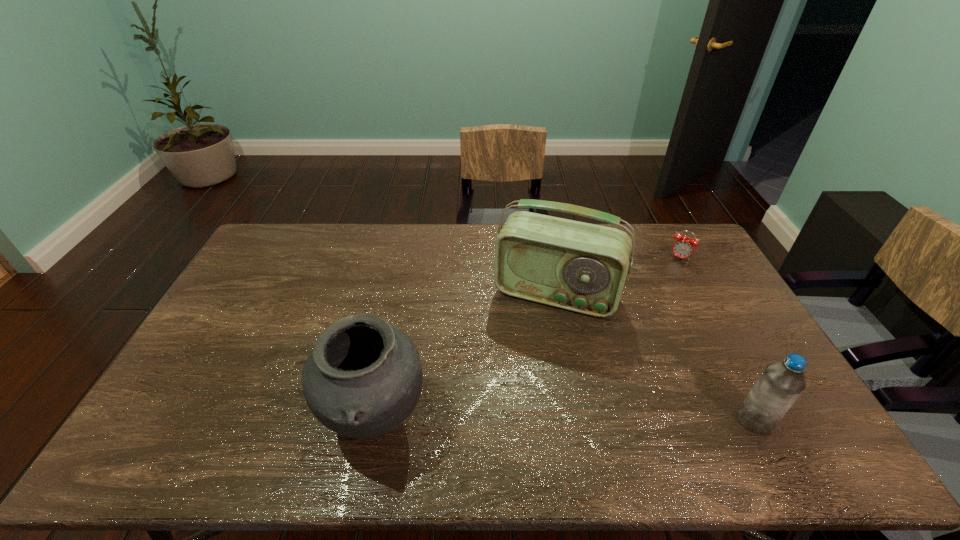
You are a GUI agent. You are given a task and a screenshot of the screen. Output one action in this format:
    pyautogui.click(x=<x>, y=<y>)
    Task: Click on the vacant area situated on the front panel of the second object from left to right
    The image size is (960, 540).
    Given the screenshot: What is the action you would take?
    pyautogui.click(x=506, y=412)

Locate an element on the screen. The image size is (960, 540). vacant space positioned on the front panel of the second object from left to right is located at coordinates (535, 333).

Locate an element on the screen. Image resolution: width=960 pixels, height=540 pixels. vacant region located 0.060m on the face of the alarm clock is located at coordinates pos(671,272).

Find the location of `free space located 0.150m on the face of the alarm clock`. free space located 0.150m on the face of the alarm clock is located at coordinates (662, 286).

What are the coordinates of `free space located on the face of the alarm clock` in the screenshot? It's located at (649, 310).

Locate an element on the screen. object that is at the far edge is located at coordinates click(683, 247).

Identify the location of urn that is at the near edge. (363, 378).

Where is `water bottle present at the near edge`? The height and width of the screenshot is (540, 960). water bottle present at the near edge is located at coordinates (781, 383).

The image size is (960, 540). I want to click on water bottle that is positioned at the right edge, so click(781, 383).

Image resolution: width=960 pixels, height=540 pixels. I want to click on alarm clock located at the right edge, so click(x=683, y=247).